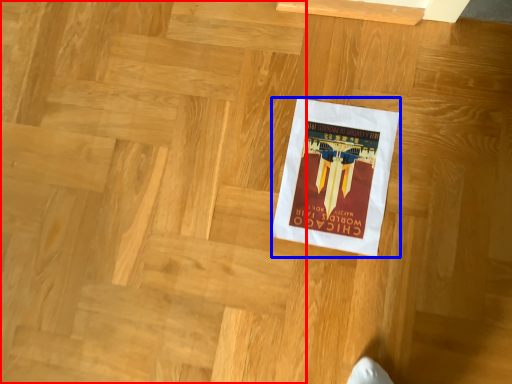
Question: Which of the following is the farthest to the observer, stairwell (highlighted by a red box) or poster (highlighted by a blue box)?

Choices:
 (A) stairwell
 (B) poster

Answer: (B)